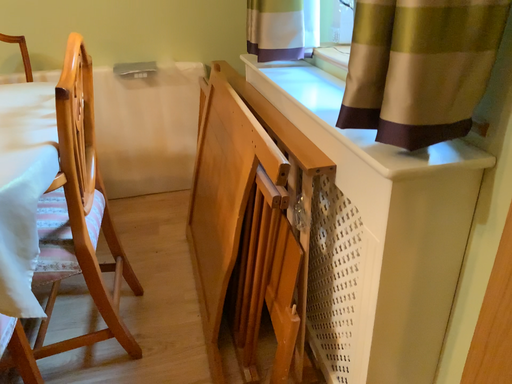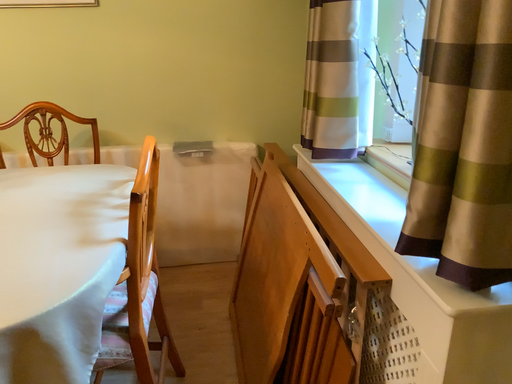
Question: How did the camera likely rotate when shooting the video?

Choices:
 (A) rotated downward
 (B) rotated upward

Answer: (B)